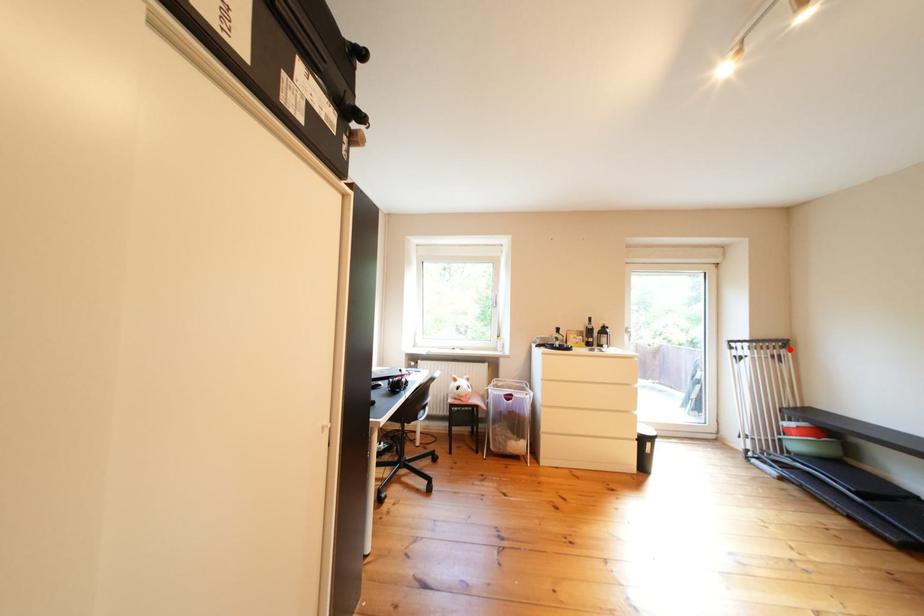
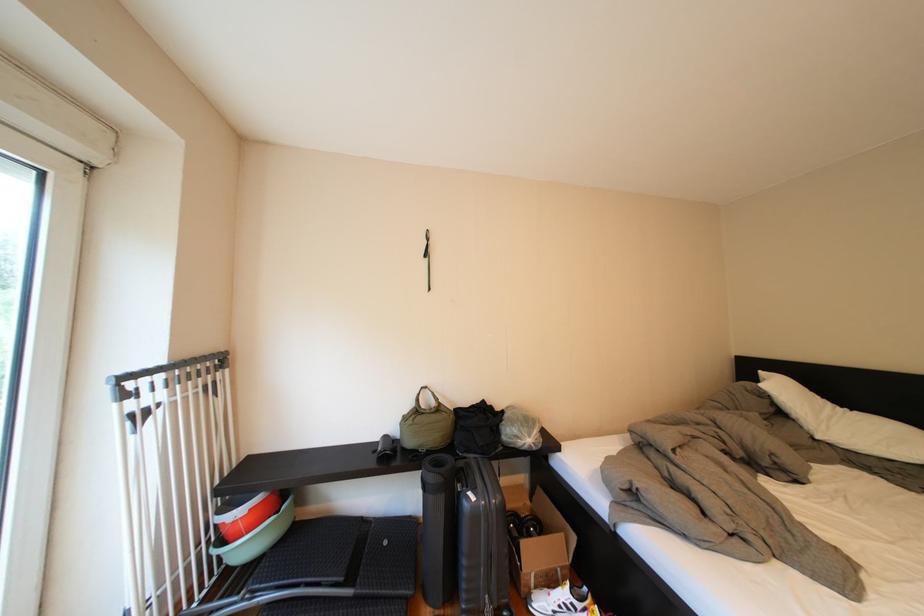
In the second image, find the point that corresponds to the highlighted location in the first image.

(224, 369)